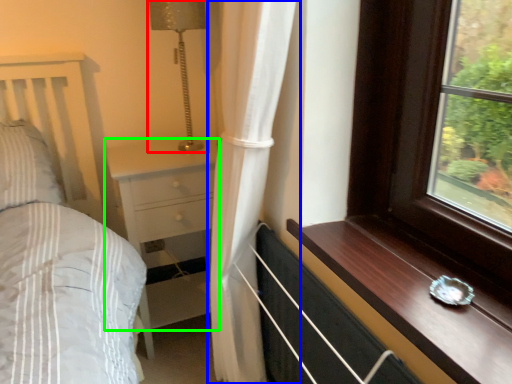
Question: Which object is the closest to the lamp (highlighted by a red box)? Choose among these: curtain (highlighted by a blue box) or chest of drawers (highlighted by a green box).

Choices:
 (A) curtain
 (B) chest of drawers

Answer: (B)